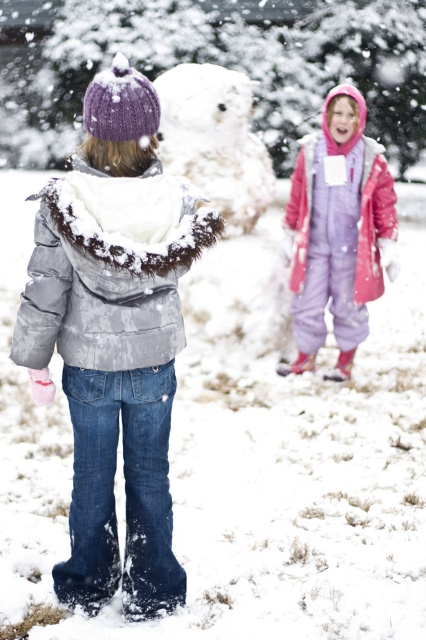
You are a photographer trying to capture a photo of the two children in the snowy scene. The camera is positioned at the center of the image. Which child, the one wearing the fuzzy gray jacket at back or the other child, is closer to the camera?

The fuzzy gray jacket at back is located at point (109, 268), which means it is closer to the camera positioned at the center of the image.

Consider the image. You are a photographer trying to capture both the white fluffy snowman at center and the purple fleece jacket at upper right in a single frame. Based on their sizes, which object should you focus on first to ensure both are in the frame?

The white fluffy snowman at center is taller than the purple fleece jacket at upper right, so you should focus on the white fluffy snowman at center first to ensure both are in the frame.

You are trying to take a photo of the white fluffy snowman at center without the fuzzy gray jacket at back appearing in the frame. Is this possible based on their positions?

The fuzzy gray jacket at back is positioned under the white fluffy snowman at center, so if you position yourself so that the snowman is in the foreground, the jacket won